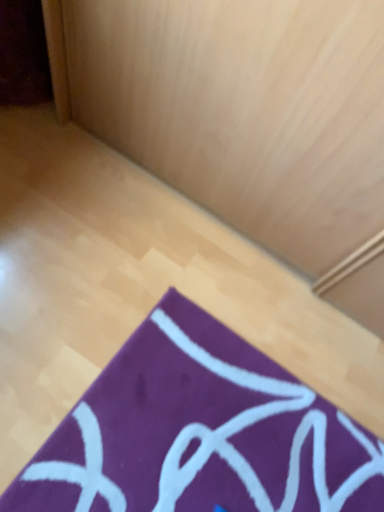
This screenshot has height=512, width=384. In order to click on purple fabric at lower center in this screenshot , I will do `click(200, 432)`.

What do you see at coordinates (200, 432) in the screenshot? I see `purple fabric at lower center` at bounding box center [200, 432].

Image resolution: width=384 pixels, height=512 pixels. Find the location of `purple fabric at lower center`. purple fabric at lower center is located at coordinates (200, 432).